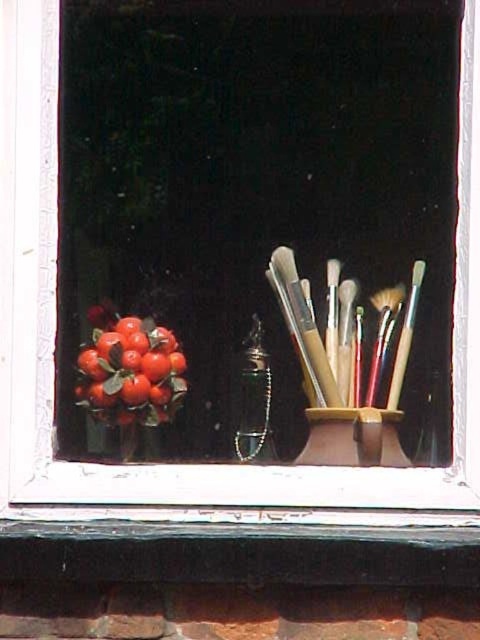
Question: Is shiny red berries at left positioned at the back of matte black brush at center right?

Choices:
 (A) no
 (B) yes

Answer: (A)

Question: Among these points, which one is nearest to the camera?

Choices:
 (A) (176, 384)
 (B) (369, 394)

Answer: (A)

Question: Is shiny red berries at left to the left of matte black brush at center right from the viewer's perspective?

Choices:
 (A) no
 (B) yes

Answer: (B)

Question: Is shiny red berries at left to the left of matte black brush at center right from the viewer's perspective?

Choices:
 (A) no
 (B) yes

Answer: (B)